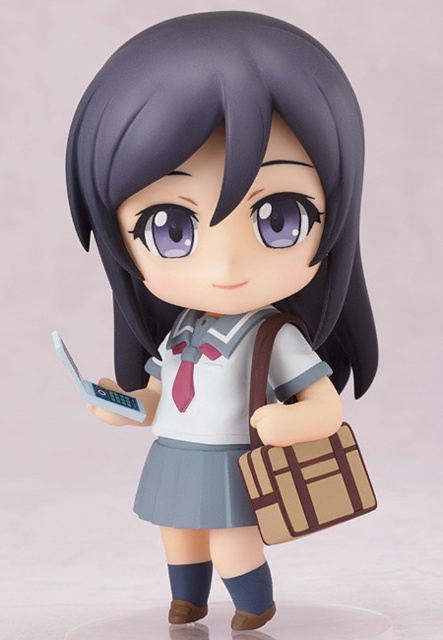
Is matte gray fabric school uniform at center bigger than beige fabric briefcase at lower right?

Yes, matte gray fabric school uniform at center is bigger than beige fabric briefcase at lower right.

Consider the image. Which of these two, matte gray fabric school uniform at center or beige fabric briefcase at lower right, stands taller?

matte gray fabric school uniform at center is taller.

Identify the location of matte gray fabric school uniform at center. The height and width of the screenshot is (640, 443). (201, 422).

Is matte plastic figure at center further to the viewer compared to beige fabric briefcase at lower right?

No, matte plastic figure at center is in front of beige fabric briefcase at lower right.

The height and width of the screenshot is (640, 443). What do you see at coordinates (224, 269) in the screenshot? I see `matte plastic figure at center` at bounding box center [224, 269].

Where is `matte plastic figure at center`? matte plastic figure at center is located at coordinates (224, 269).

Is matte plastic figure at center wider than matte gray fabric school uniform at center?

Indeed, matte plastic figure at center has a greater width compared to matte gray fabric school uniform at center.

Where is `matte plastic figure at center`? matte plastic figure at center is located at coordinates (224, 269).